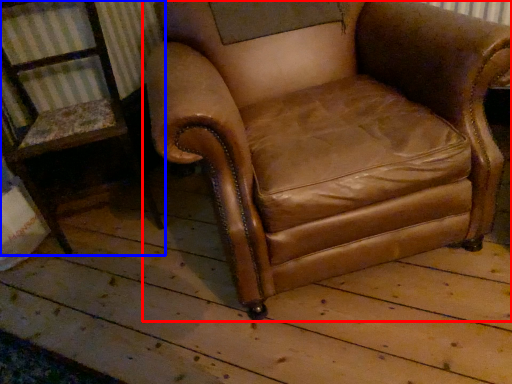
Question: Which object appears closest to the camera in this image, chair (highlighted by a red box) or chair (highlighted by a blue box)?

Choices:
 (A) chair
 (B) chair

Answer: (A)